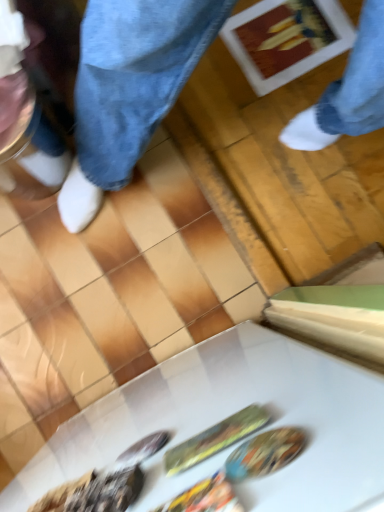
Question: Does shiny plastic spoon at center, arranged as the first food when viewed from the right, appear on the left side of shiny plastic bag at center, positioned as the second food in right-to-left order?

Choices:
 (A) yes
 (B) no

Answer: (B)

Question: Is shiny plastic bag at center, the second food from the left, a part of shiny plastic spoon at center, arranged as the first food when viewed from the right?

Choices:
 (A) yes
 (B) no

Answer: (B)

Question: Can you confirm if shiny plastic spoon at center, arranged as the first food when viewed from the right, is bigger than shiny plastic bag at center, positioned as the second food in right-to-left order?

Choices:
 (A) no
 (B) yes

Answer: (B)

Question: Are shiny plastic spoon at center, arranged as the first food when viewed from the right, and shiny plastic bag at center, positioned as the second food in right-to-left order, beside each other?

Choices:
 (A) yes
 (B) no

Answer: (A)

Question: Considering the relative positions of shiny plastic spoon at center, which ranks as the third food in left-to-right order, and shiny plastic bag at center, the second food from the left, in the image provided, is shiny plastic spoon at center, which ranks as the third food in left-to-right order, to the right of shiny plastic bag at center, the second food from the left, from the viewer's perspective?

Choices:
 (A) yes
 (B) no

Answer: (A)

Question: Can you confirm if shiny plastic spoon at center, which ranks as the third food in left-to-right order, is taller than shiny plastic bag at center, positioned as the second food in right-to-left order?

Choices:
 (A) no
 (B) yes

Answer: (A)

Question: Can you confirm if white glossy table at lower center is bigger than shiny metallic spoon at lower left, the third food from the right?

Choices:
 (A) yes
 (B) no

Answer: (A)

Question: Can we say white glossy table at lower center lies outside shiny metallic spoon at lower left, the third food from the right?

Choices:
 (A) no
 (B) yes

Answer: (B)

Question: Does white glossy table at lower center have a smaller size compared to shiny metallic spoon at lower left, the third food from the right?

Choices:
 (A) yes
 (B) no

Answer: (B)

Question: From the image's perspective, is white glossy table at lower center under shiny metallic spoon at lower left, the third food from the right?

Choices:
 (A) no
 (B) yes

Answer: (B)

Question: Does white glossy table at lower center contain shiny metallic spoon at lower left, the third food from the right?

Choices:
 (A) no
 (B) yes

Answer: (B)

Question: From the image's perspective, is white glossy table at lower center located above shiny metallic spoon at lower left, the third food from the right?

Choices:
 (A) yes
 (B) no

Answer: (B)

Question: Are shiny plastic bag at center, the second food from the left, and white glossy table at lower center far apart?

Choices:
 (A) yes
 (B) no

Answer: (B)